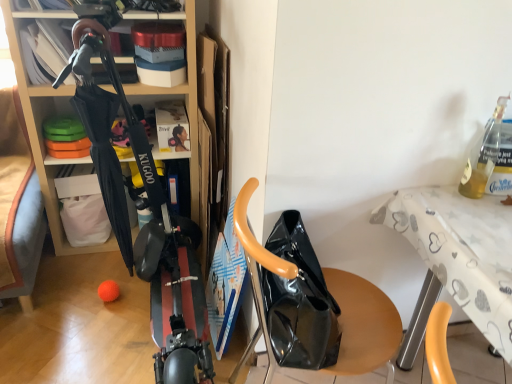
At what (x,y) coordinates should I click in order to perform the action: click on free space in front of translucent glass bottle at upper right. Please return your answer as a coordinate pair (x, y). Looking at the image, I should click on (493, 216).